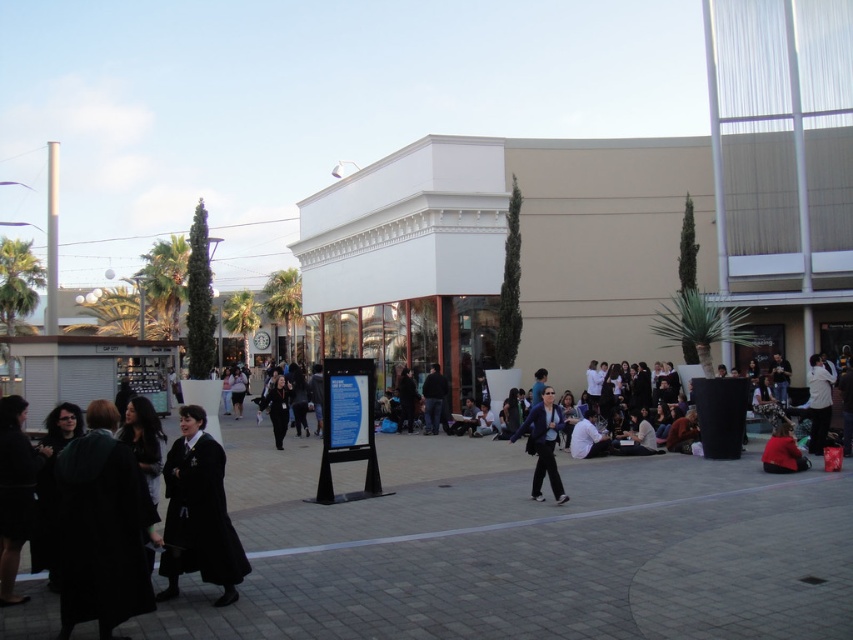
Question: Which object is closer to the camera taking this photo?

Choices:
 (A) black matte jacket at center
 (B) white matte jacket at lower right

Answer: (B)

Question: Which point is farther from the camera taking this photo?

Choices:
 (A) (816, 445)
 (B) (70, 472)

Answer: (A)

Question: Which point appears farthest from the camera in this image?

Choices:
 (A) (283, 426)
 (B) (785, 451)

Answer: (A)

Question: Can you confirm if black fabric coat at center is positioned above black matte jacket at center?

Choices:
 (A) no
 (B) yes

Answer: (B)

Question: Does smooth concrete pavement at center appear on the left side of black fabric coat at center?

Choices:
 (A) no
 (B) yes

Answer: (A)

Question: Is black fabric coat at center positioned before white matte jacket at lower right?

Choices:
 (A) yes
 (B) no

Answer: (A)